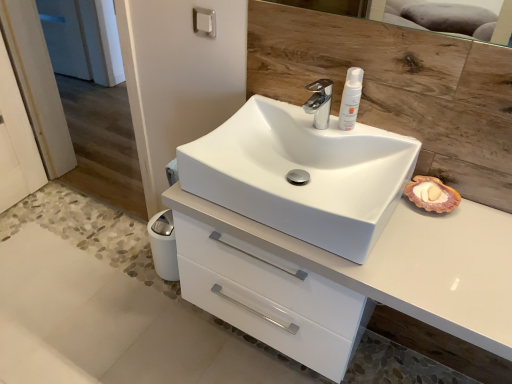
In order to click on free space above white glossy cabinet at center (from a real-world perspective) in this screenshot , I will do `click(432, 249)`.